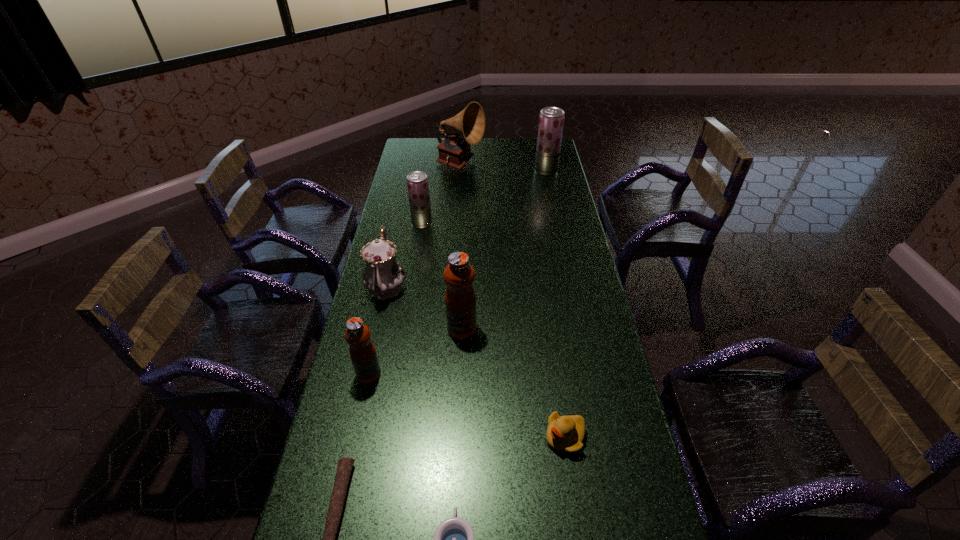
At what (x,y) coordinates should I click in order to perform the action: click on free space that satisfies the following two spatial constraints: 1. on the back side of the third nearest fruit juice; 2. on the right side of the farther strawberry fruit juice. Please return your answer as a coordinate pair (x, y). This screenshot has height=540, width=960. Looking at the image, I should click on (430, 171).

Where is `vacant space that satisfies the following two spatial constraints: 1. on the front side of the farthest fruit juice; 2. on the beak of the duckling`? vacant space that satisfies the following two spatial constraints: 1. on the front side of the farthest fruit juice; 2. on the beak of the duckling is located at coordinates (604, 437).